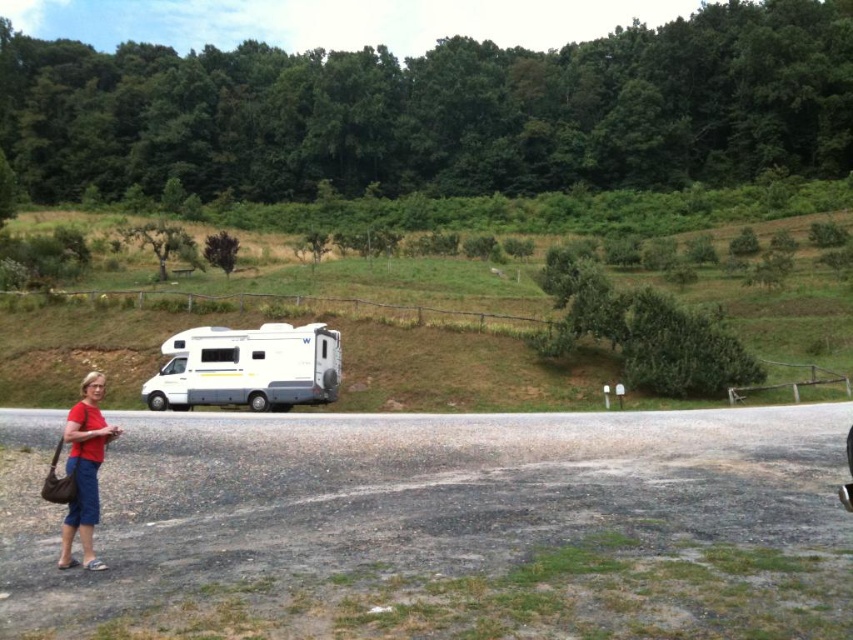
Question: Is white glossy recreational vehicle at center wider than matte red shirt at lower left?

Choices:
 (A) no
 (B) yes

Answer: (A)

Question: Which point is farther to the camera?

Choices:
 (A) (115, 426)
 (B) (299, 330)

Answer: (B)

Question: Does white glossy recreational vehicle at center have a greater width compared to matte red shirt at lower left?

Choices:
 (A) no
 (B) yes

Answer: (A)

Question: Is white glossy recreational vehicle at center to the right of matte red shirt at lower left from the viewer's perspective?

Choices:
 (A) no
 (B) yes

Answer: (B)

Question: Which object appears farthest from the camera in this image?

Choices:
 (A) white glossy recreational vehicle at center
 (B) matte red shirt at lower left

Answer: (A)